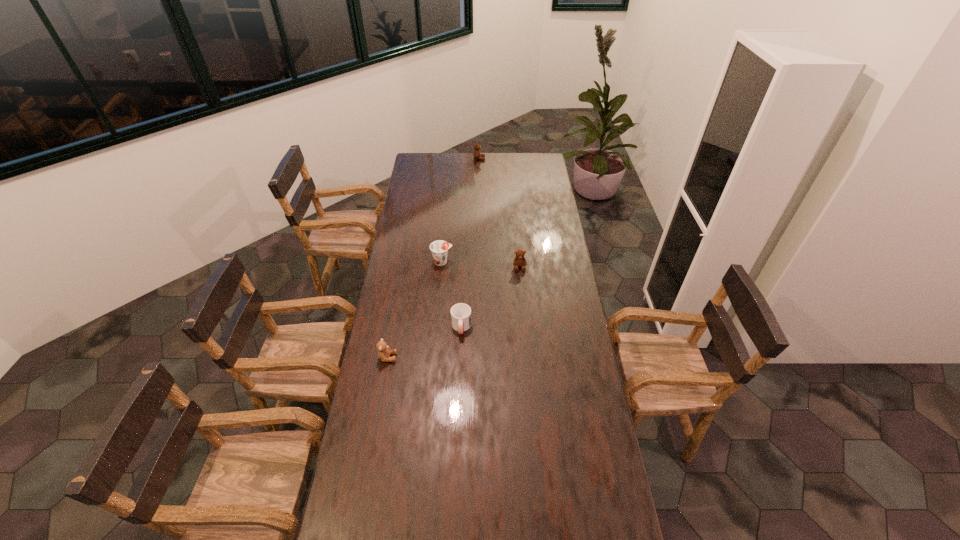
Identify the location of vacant region located 0.140m on the face of the leftmost object. (432, 357).

Image resolution: width=960 pixels, height=540 pixels. Identify the location of free region located 0.210m on the face of the second nearest teddy bear. point(523,306).

At what (x,y) coordinates should I click in order to perform the action: click on vacant region located on the side of the fourth farthest object with the handle. Please return your answer as a coordinate pair (x, y). This screenshot has height=540, width=960. Looking at the image, I should click on (460, 359).

Where is `object positioned at the far edge`? The height and width of the screenshot is (540, 960). object positioned at the far edge is located at coordinates (477, 155).

What are the coordinates of `object that is at the left edge` in the screenshot? It's located at (384, 352).

Identify the location of vacant space at the far edge of the desktop. The width and height of the screenshot is (960, 540). (496, 168).

At what (x,y) coordinates should I click in order to perform the action: click on vacant space at the left edge. Please return your answer as a coordinate pair (x, y). Looking at the image, I should click on (426, 188).

The height and width of the screenshot is (540, 960). Find the location of `free space at the right edge`. free space at the right edge is located at coordinates tap(595, 417).

This screenshot has height=540, width=960. Find the location of `free point between the mug and the farthest object`. free point between the mug and the farthest object is located at coordinates (470, 243).

Identify the location of free spot between the second teddy bear from left to right and the mug. (470, 243).